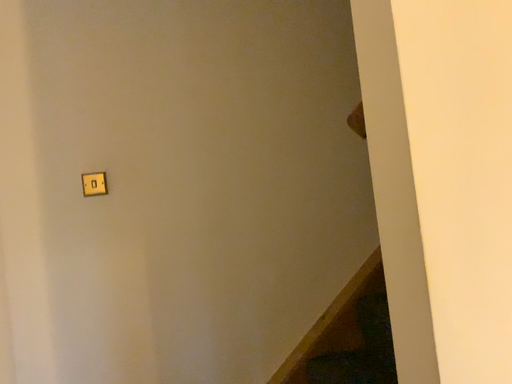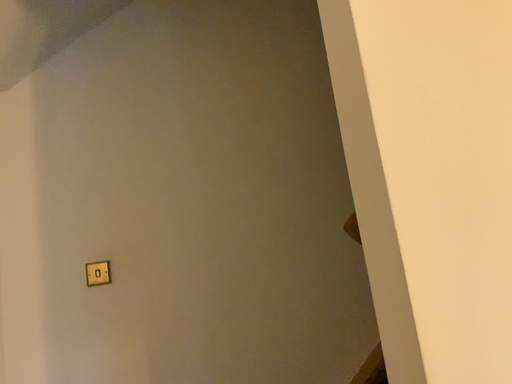
Question: How did the camera likely rotate when shooting the video?

Choices:
 (A) rotated upward
 (B) rotated downward

Answer: (A)